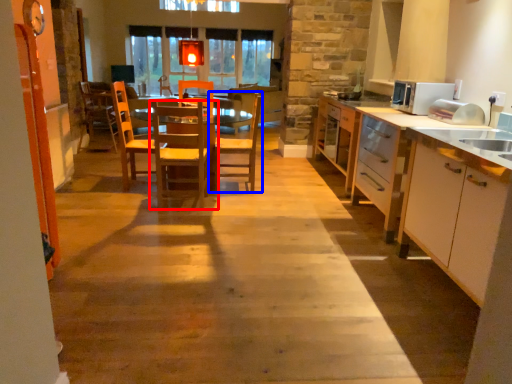
Question: Among these objects, which one is farthest to the camera, chair (highlighted by a red box) or chair (highlighted by a blue box)?

Choices:
 (A) chair
 (B) chair

Answer: (B)